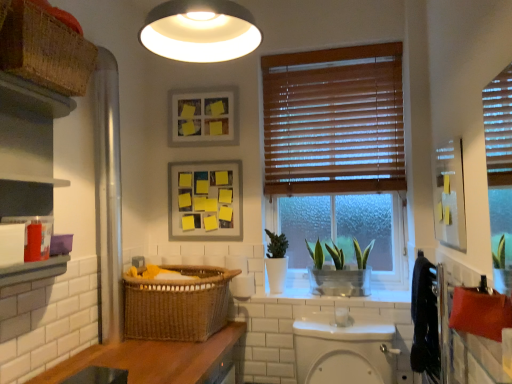
The height and width of the screenshot is (384, 512). I want to click on free spot in front of woven brown basket at lower left, the 2th basket from the left, so click(172, 354).